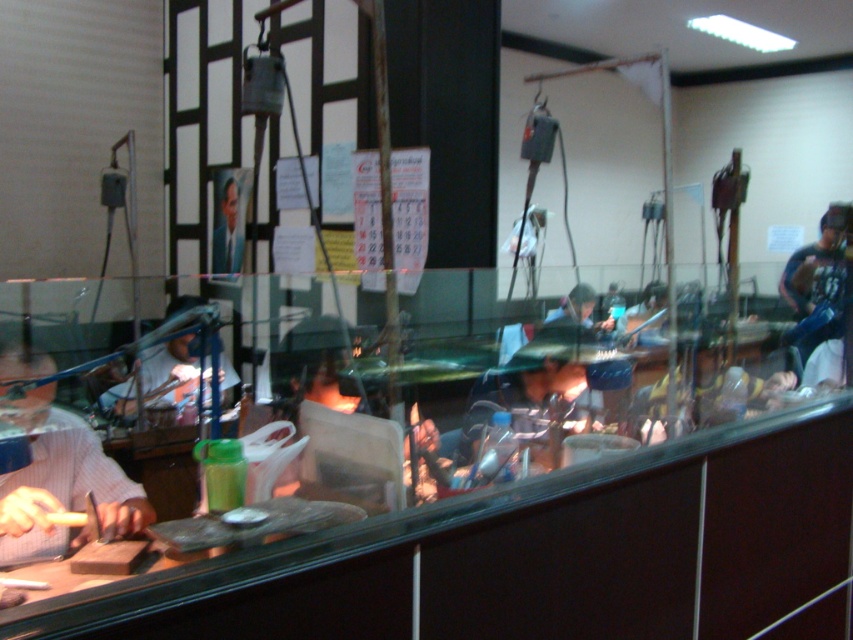
Question: Which point appears closest to the camera in this image?

Choices:
 (A) (804, 305)
 (B) (222, 259)

Answer: (B)

Question: Which point is closer to the camera taking this photo?

Choices:
 (A) (33, 358)
 (B) (572, 314)

Answer: (A)

Question: Which point is closer to the camera?

Choices:
 (A) (842, 266)
 (B) (583, 304)
 (C) (131, 481)
 (D) (190, 380)

Answer: (C)

Question: Is dark blue jeans at right to the left of matte black laptop at center from the viewer's perspective?

Choices:
 (A) yes
 (B) no

Answer: (B)

Question: Can you confirm if smooth skin face at center is thinner than matte black laptop at center?

Choices:
 (A) yes
 (B) no

Answer: (A)

Question: Does dark blue jeans at right lie behind white plastic bag at left?

Choices:
 (A) yes
 (B) no

Answer: (A)